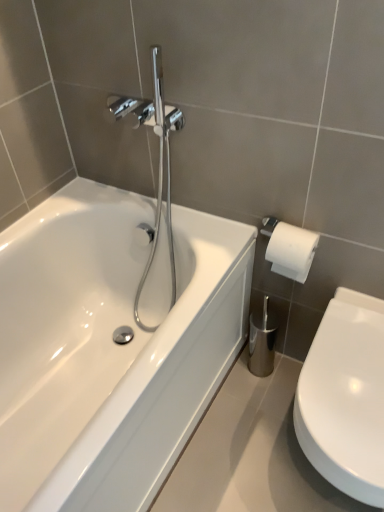
Question: Could white glossy toilet at lower right be considered to be inside white glossy bathtub at left?

Choices:
 (A) yes
 (B) no

Answer: (B)

Question: Are white glossy bathtub at left and white glossy toilet at lower right beside each other?

Choices:
 (A) no
 (B) yes

Answer: (A)

Question: From the image's perspective, is white glossy bathtub at left located beneath white glossy toilet at lower right?

Choices:
 (A) yes
 (B) no

Answer: (B)

Question: Can we say white glossy bathtub at left lies outside white glossy toilet at lower right?

Choices:
 (A) no
 (B) yes

Answer: (B)

Question: Considering the relative sizes of white glossy bathtub at left and white glossy toilet at lower right in the image provided, is white glossy bathtub at left thinner than white glossy toilet at lower right?

Choices:
 (A) yes
 (B) no

Answer: (B)

Question: From a real-world perspective, is white glossy bathtub at left beneath white glossy toilet at lower right?

Choices:
 (A) no
 (B) yes

Answer: (A)

Question: Considering the relative positions of white glossy toilet at lower right and white glossy bathtub at left in the image provided, is white glossy toilet at lower right to the right of white glossy bathtub at left from the viewer's perspective?

Choices:
 (A) yes
 (B) no

Answer: (A)

Question: Would you consider white glossy toilet at lower right to be distant from white glossy bathtub at left?

Choices:
 (A) no
 (B) yes

Answer: (A)

Question: Considering the relative positions of white glossy toilet at lower right and white glossy bathtub at left in the image provided, is white glossy toilet at lower right in front of white glossy bathtub at left?

Choices:
 (A) no
 (B) yes

Answer: (A)

Question: Would you say white glossy toilet at lower right contains white glossy bathtub at left?

Choices:
 (A) no
 (B) yes

Answer: (A)

Question: Is the depth of white glossy toilet at lower right greater than that of white glossy bathtub at left?

Choices:
 (A) yes
 (B) no

Answer: (A)

Question: Considering the relative sizes of white glossy toilet at lower right and white glossy bathtub at left in the image provided, is white glossy toilet at lower right wider than white glossy bathtub at left?

Choices:
 (A) yes
 (B) no

Answer: (B)

Question: Based on their sizes in the image, would you say white glossy bathtub at left is bigger or smaller than white glossy toilet at lower right?

Choices:
 (A) small
 (B) big

Answer: (B)